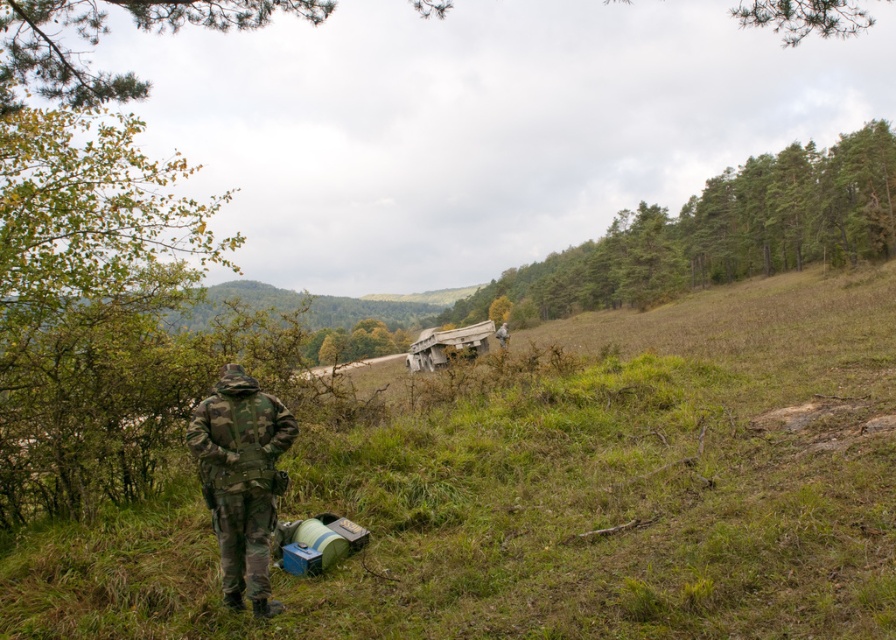
Question: Which object is closer to the camera taking this photo?

Choices:
 (A) camouflage fabric soldier at center
 (B) camouflage fabric uniform at lower left
 (C) green grassy at center

Answer: (C)

Question: Can you confirm if green grassy at center is bigger than camouflage fabric uniform at lower left?

Choices:
 (A) no
 (B) yes

Answer: (B)

Question: Which point appears farthest from the camera in this image?

Choices:
 (A) (222, 580)
 (B) (182, 532)
 (C) (501, 324)

Answer: (C)

Question: Can you confirm if green grassy at center is positioned to the right of camouflage fabric uniform at lower left?

Choices:
 (A) no
 (B) yes

Answer: (B)

Question: Where is green grassy at center located in relation to camouflage fabric soldier at center in the image?

Choices:
 (A) right
 (B) left

Answer: (B)

Question: Which point appears farthest from the camera in this image?

Choices:
 (A) (498, 340)
 (B) (386, 461)
 (C) (263, 572)

Answer: (A)